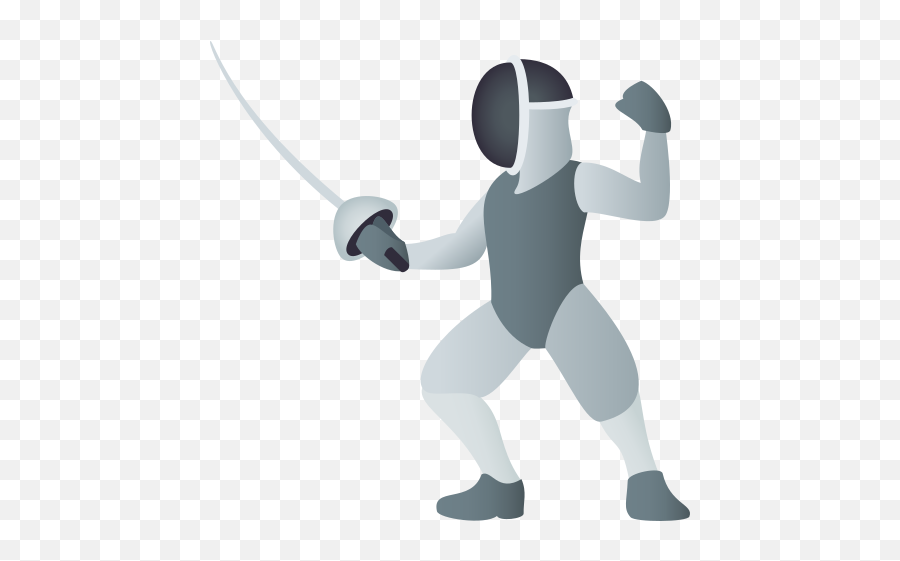
The width and height of the screenshot is (900, 561). I want to click on chest, so click(x=522, y=209).